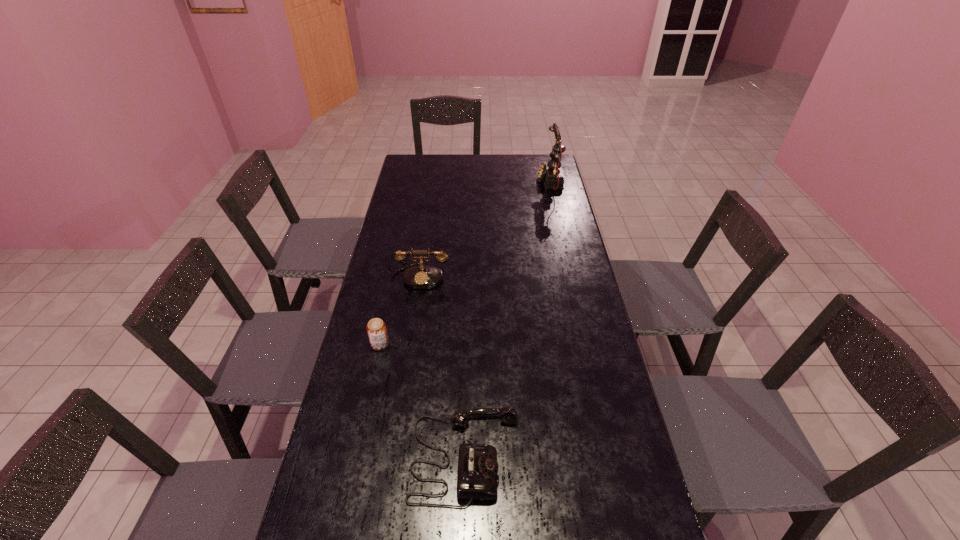
Locate an element on the screen. The height and width of the screenshot is (540, 960). vacant area between the tallest telephone and the second tallest object is located at coordinates (485, 228).

Locate an element on the screen. Image resolution: width=960 pixels, height=540 pixels. free space between the nearest object and the second nearest telephone is located at coordinates (443, 366).

Identify which object is the closest to the second farthest object. Please provide its 2D coordinates. Your answer should be formatted as a tuple, i.e. [(x, y)], where the tuple contains the x and y coordinates of a point satisfying the conditions above.

[(376, 328)]

Find the location of a particular element. object that is the third closest one to the second tallest object is located at coordinates (550, 171).

Point out which telephone is positioned as the second nearest to the nearest object. Please provide its 2D coordinates. Your answer should be formatted as a tuple, i.e. [(x, y)], where the tuple contains the x and y coordinates of a point satisfying the conditions above.

[(550, 171)]

The image size is (960, 540). I want to click on telephone that stands as the second closest to the tallest telephone, so click(x=477, y=472).

Find the location of a particular element. The width and height of the screenshot is (960, 540). free space that satisfies the following two spatial constraints: 1. on the dial of the farthest telephone; 2. on the dial of the second farthest telephone is located at coordinates (572, 276).

The height and width of the screenshot is (540, 960). What are the coordinates of `vacant area that satisfies the following two spatial constraints: 1. on the dial of the farthest object; 2. on the front side of the second nearest object` in the screenshot? It's located at (588, 344).